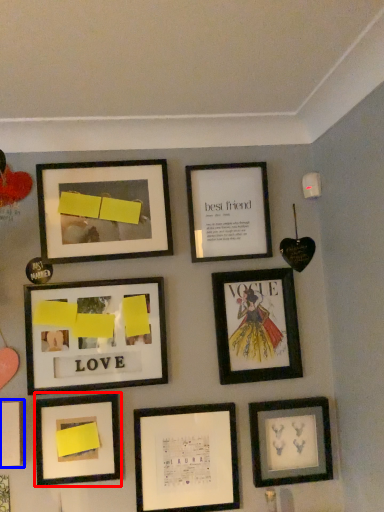
Question: Among these objects, which one is nearest to the camera, picture frame (highlighted by a red box) or picture frame (highlighted by a blue box)?

Choices:
 (A) picture frame
 (B) picture frame

Answer: (B)